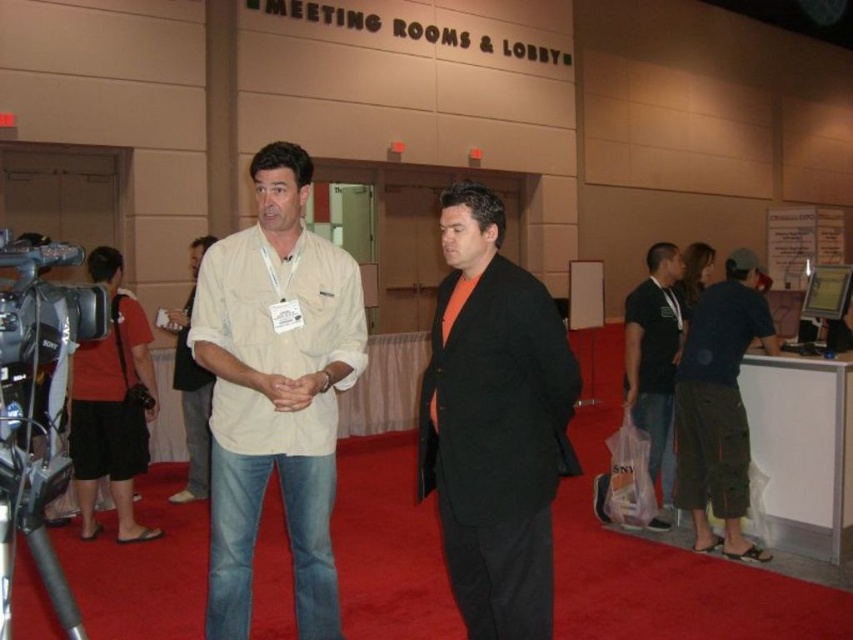
Between beige cotton shirt at center and orange cotton shirt at center, which one has less height?

orange cotton shirt at center

Image resolution: width=853 pixels, height=640 pixels. What are the coordinates of `beige cotton shirt at center` in the screenshot? It's located at (276, 392).

Where is `beige cotton shirt at center`? The width and height of the screenshot is (853, 640). beige cotton shirt at center is located at coordinates (276, 392).

Who is more forward, (x=723, y=348) or (x=672, y=289)?

Point (x=723, y=348)

Between point (724, 321) and point (660, 524), which one is positioned behind?

The point (660, 524) is more distant.

Which is in front, point (733, 273) or point (660, 451)?

Positioned in front is point (733, 273).

Where is `dark green cargo pants at right`? dark green cargo pants at right is located at coordinates (718, 404).

Is orange cotton shirt at center taller than black cotton shirt at right?

In fact, orange cotton shirt at center may be shorter than black cotton shirt at right.

Does point (503, 294) lie in front of point (656, 518)?

Yes, it is in front of point (656, 518).

Which is in front, point (488, 212) or point (651, 285)?

Point (488, 212)

Locate an element on the screen. orange cotton shirt at center is located at coordinates (494, 422).